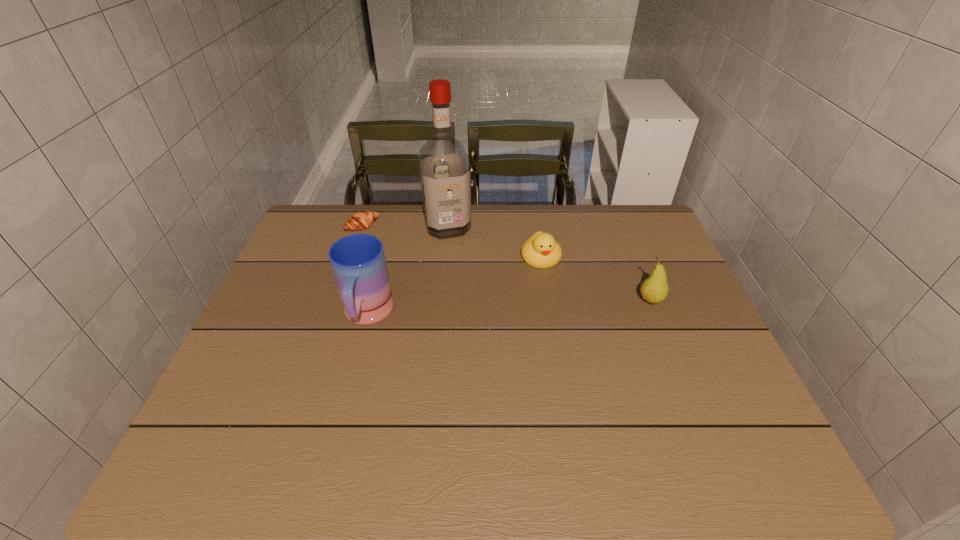
Locate an element on the screen. The height and width of the screenshot is (540, 960). mug is located at coordinates (358, 262).

What are the coordinates of `the rightmost object` in the screenshot? It's located at (654, 289).

Find the location of a particular element. The height and width of the screenshot is (540, 960). the third tallest object is located at coordinates (654, 289).

What are the coordinates of `the tallest object` in the screenshot? It's located at (445, 175).

Identify the location of liquor. (445, 175).

Locate an element on the screen. pastry is located at coordinates (361, 220).

Find the location of a particular element. The image size is (960, 540). duckling is located at coordinates (541, 250).

At what (x,y) coordinates should I click in order to perform the action: click on the second shortest object. Please return your answer as a coordinate pair (x, y). The width and height of the screenshot is (960, 540). Looking at the image, I should click on (541, 250).

The width and height of the screenshot is (960, 540). Find the location of `free region located on the side of the mug with the handle`. free region located on the side of the mug with the handle is located at coordinates (349, 383).

At what (x,y) coordinates should I click in order to perform the action: click on blank area located on the back of the pear. Please return your answer as a coordinate pair (x, y). The height and width of the screenshot is (540, 960). Looking at the image, I should click on point(631,251).